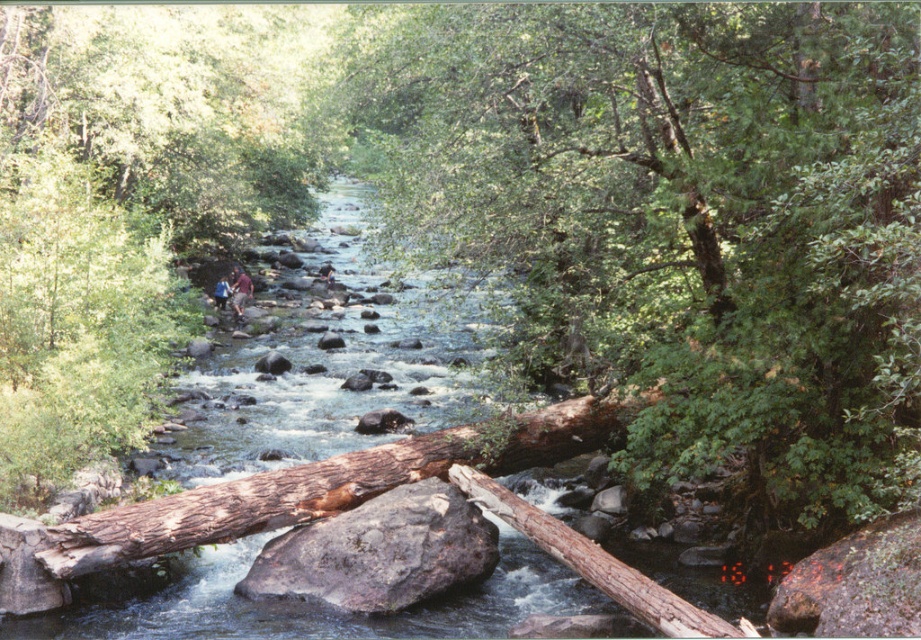
Can you confirm if smooth brown log at center is positioned to the right of brown rough rock at center?

Correct, you'll find smooth brown log at center to the right of brown rough rock at center.

Locate an element on the screen. Image resolution: width=921 pixels, height=640 pixels. smooth brown log at center is located at coordinates (679, 218).

Describe the element at coordinates (239, 291) in the screenshot. I see `brown leather jacket at center` at that location.

Between brown leather jacket at center and brown leather jacket at upper center, which one appears on the right side from the viewer's perspective?

Positioned to the right is brown leather jacket at center.

Which is behind, point (240, 269) or point (217, 292)?

The point (240, 269) is more distant.

Where is `brown leather jacket at center`? brown leather jacket at center is located at coordinates (239, 291).

How far apart are smooth brown log at center and brown leather jacket at upper center?

smooth brown log at center is 17.45 meters away from brown leather jacket at upper center.

Is smooth brown log at center positioned before brown leather jacket at upper center?

Yes, it is in front of brown leather jacket at upper center.

Between point (426, 97) and point (222, 296), which one is positioned behind?

The point (222, 296) is more distant.

Identify the location of smooth brown log at center. The image size is (921, 640). (679, 218).